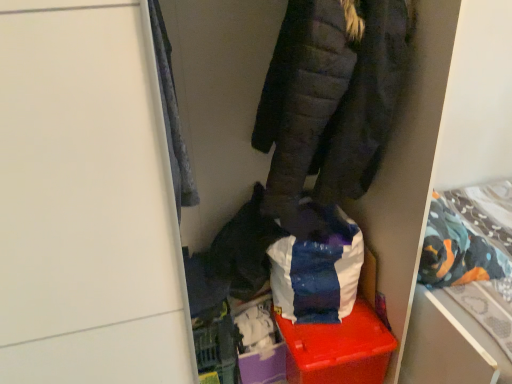
Question: In terms of size, does dark gray quilted jacket at upper center appear bigger or smaller than patterned fabric bed at right?

Choices:
 (A) small
 (B) big

Answer: (A)

Question: Would you say dark gray quilted jacket at upper center is to the left or to the right of patterned fabric bed at right in the picture?

Choices:
 (A) right
 (B) left

Answer: (B)

Question: Which is nearer to the velvety gray blanket at upper left?

Choices:
 (A) matte plastic storage box at center
 (B) patterned fabric bed at right
 (C) dark gray quilted jacket at upper center

Answer: (C)

Question: Which is nearer to the matte plastic storage box at center?

Choices:
 (A) velvety gray blanket at upper left
 (B) dark gray quilted jacket at upper center
 (C) patterned fabric bed at right

Answer: (C)